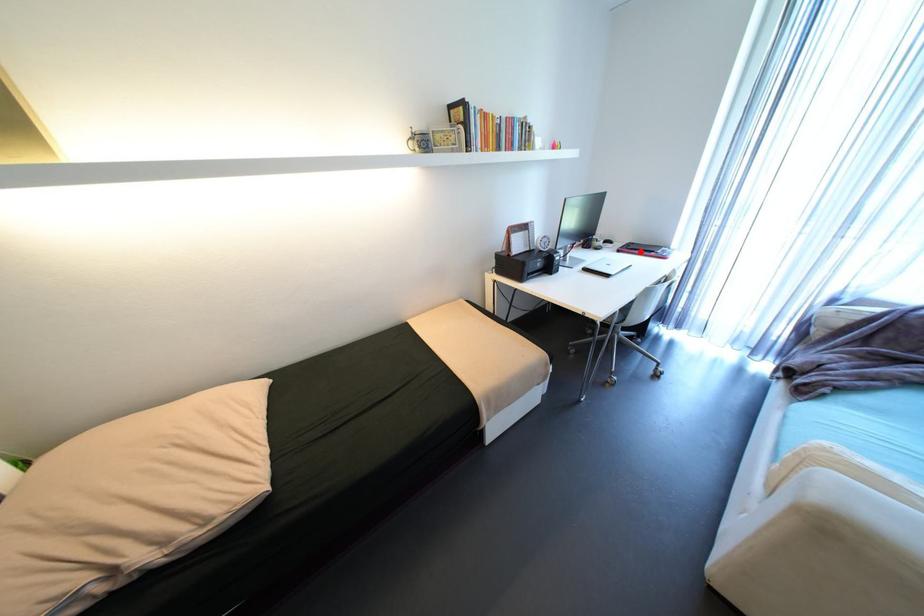
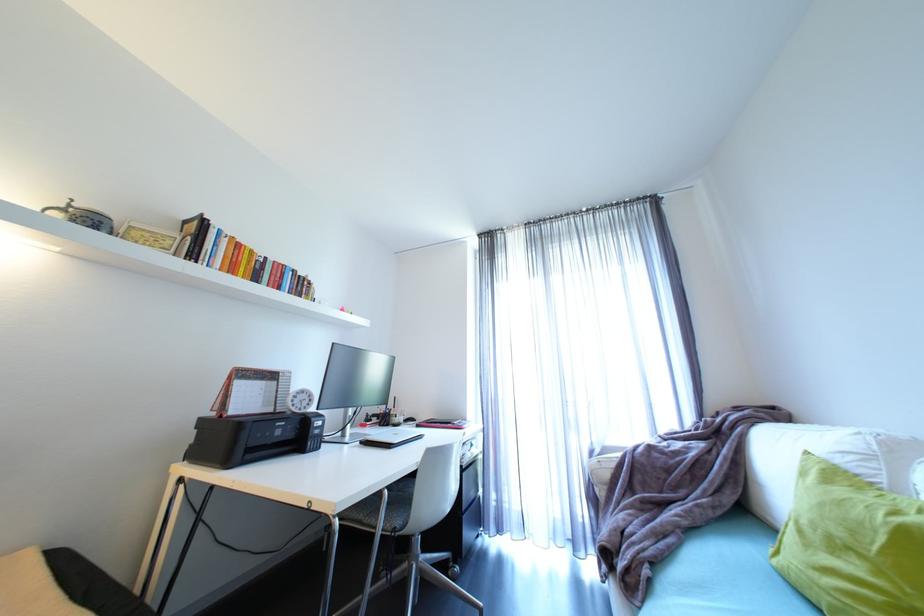
Find the pixel in the second image that matches the highlighted location in the first image.

(440, 424)